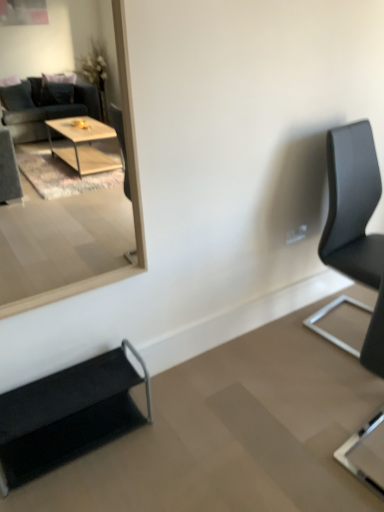
The height and width of the screenshot is (512, 384). What do you see at coordinates (75, 221) in the screenshot?
I see `wooden frame mirror at upper left` at bounding box center [75, 221].

Find the location of a particular element. wooden frame mirror at upper left is located at coordinates (75, 221).

Where is `black leather chair at right, which is counted as the second chair, starting from the right`? black leather chair at right, which is counted as the second chair, starting from the right is located at coordinates (375, 338).

What's the angular difference between wooden frame mirror at upper left and black leather chair at right, the 2th chair positioned from the left,'s facing directions?

The angle between the facing direction of wooden frame mirror at upper left and the facing direction of black leather chair at right, the 2th chair positioned from the left, is 96.2 degrees.

Could you tell me if wooden frame mirror at upper left is turned towards black leather chair at right, the 2th chair positioned from the left?

No.

From the image's perspective, would you say wooden frame mirror at upper left is positioned over black leather chair at right, the 2th chair positioned from the left?

Yes, from the image's perspective, wooden frame mirror at upper left is over black leather chair at right, the 2th chair positioned from the left.

Can you confirm if wooden frame mirror at upper left is bigger than black leather chair at right, the 2th chair positioned from the left?

No, wooden frame mirror at upper left is not bigger than black leather chair at right, the 2th chair positioned from the left.

From the picture: Are black leather chair at right, the 2th chair positioned from the left, and black fabric chair at lower left, the 3th chair positioned from the right, beside each other?

black leather chair at right, the 2th chair positioned from the left, and black fabric chair at lower left, the 3th chair positioned from the right, are clearly separated.

Can you tell me how much black leather chair at right, the 2th chair positioned from the left, and black fabric chair at lower left, the 3th chair positioned from the right, differ in facing direction?

The facing directions of black leather chair at right, the 2th chair positioned from the left, and black fabric chair at lower left, the 3th chair positioned from the right, are 96.2 degrees apart.

From a real-world perspective, who is located higher, black leather chair at right, the 2th chair positioned from the left, or black fabric chair at lower left, the 3th chair positioned from the right?

black leather chair at right, the 2th chair positioned from the left, is physically above.

Which object is closer to the camera taking this photo, black leather chair at right, the 2th chair positioned from the left, or black fabric chair at lower left, marked as the 1th chair in a left-to-right arrangement?

black leather chair at right, the 2th chair positioned from the left, is more forward.

Relative to wooden frame mirror at upper left, is black leather chair at right, the first chair from the right, in front or behind?

Clearly, black leather chair at right, the first chair from the right, is behind wooden frame mirror at upper left.

Starting from the wooden frame mirror at upper left, which chair is the 2nd one behind? Please provide its 2D coordinates.

[(352, 204)]

Between black leather chair at right, the first chair from the right, and wooden frame mirror at upper left, which one has smaller size?

wooden frame mirror at upper left is smaller.

Measure the distance between black leather chair at right, the first chair from the right, and wooden frame mirror at upper left.

black leather chair at right, the first chair from the right, is 14.60 feet away from wooden frame mirror at upper left.

Which is in front, black fabric chair at lower left, the 3th chair positioned from the right, or black leather chair at right, positioned as the third chair in left-to-right order?

Positioned in front is black fabric chair at lower left, the 3th chair positioned from the right.

Which is more to the left, black fabric chair at lower left, marked as the 1th chair in a left-to-right arrangement, or black leather chair at right, the first chair from the right?

black fabric chair at lower left, marked as the 1th chair in a left-to-right arrangement.

You are a GUI agent. You are given a task and a screenshot of the screen. Output one action in this format:
    pyautogui.click(x=<x>, y=<y>)
    Task: Click on the chair that is the 2nd one when counting rightward from the black fabric chair at lower left, marked as the 1th chair in a left-to-right arrangement
    
    Given the screenshot: What is the action you would take?
    pyautogui.click(x=352, y=204)

From a real-world perspective, is black fabric chair at lower left, marked as the 1th chair in a left-to-right arrangement, above or below black leather chair at right, the first chair from the right?

black fabric chair at lower left, marked as the 1th chair in a left-to-right arrangement, is situated lower than black leather chair at right, the first chair from the right, in the real world.

Is the surface of black fabric chair at lower left, the 3th chair positioned from the right, in direct contact with black leather chair at right, the 2th chair positioned from the left?

No, black fabric chair at lower left, the 3th chair positioned from the right, is not making contact with black leather chair at right, the 2th chair positioned from the left.

Looking at this image, is black fabric chair at lower left, marked as the 1th chair in a left-to-right arrangement, completely or partially outside of black leather chair at right, the 2th chair positioned from the left?

Yes, black fabric chair at lower left, marked as the 1th chair in a left-to-right arrangement, is not within black leather chair at right, the 2th chair positioned from the left.

From a real-world perspective, who is located higher, black fabric chair at lower left, marked as the 1th chair in a left-to-right arrangement, or black leather chair at right, which is counted as the second chair, starting from the right?

black leather chair at right, which is counted as the second chair, starting from the right.

How distant is black fabric chair at lower left, the 3th chair positioned from the right, from black leather chair at right, the 2th chair positioned from the left?

The distance of black fabric chair at lower left, the 3th chair positioned from the right, from black leather chair at right, the 2th chair positioned from the left, is 3.30 feet.

Consider the image. Is black leather chair at right, positioned as the third chair in left-to-right order, taller or shorter than black fabric chair at lower left, the 3th chair positioned from the right?

Clearly, black leather chair at right, positioned as the third chair in left-to-right order, is taller compared to black fabric chair at lower left, the 3th chair positioned from the right.

Which object is positioned more to the left, black leather chair at right, the first chair from the right, or black fabric chair at lower left, the 3th chair positioned from the right?

From the viewer's perspective, black fabric chair at lower left, the 3th chair positioned from the right, appears more on the left side.

Is black leather chair at right, positioned as the third chair in left-to-right order, in front of black fabric chair at lower left, the 3th chair positioned from the right?

No, black leather chair at right, positioned as the third chair in left-to-right order, is further to the viewer.

Considering the relative sizes of wooden frame mirror at upper left and black leather chair at right, the first chair from the right, in the image provided, is wooden frame mirror at upper left wider than black leather chair at right, the first chair from the right,?

Incorrect, the width of wooden frame mirror at upper left does not surpass that of black leather chair at right, the first chair from the right.

Find the location of `mirror that appears above the black leather chair at right, positioned as the third chair in left-to-right order (from a real-world perspective)`. mirror that appears above the black leather chair at right, positioned as the third chair in left-to-right order (from a real-world perspective) is located at coordinates (75, 221).

Are wooden frame mirror at upper left and black leather chair at right, positioned as the third chair in left-to-right order, beside each other?

No, wooden frame mirror at upper left is not beside black leather chair at right, positioned as the third chair in left-to-right order.

Is wooden frame mirror at upper left located outside black leather chair at right, the first chair from the right?

Absolutely, wooden frame mirror at upper left is external to black leather chair at right, the first chair from the right.

Which chair is the 1st one when counting from the right side of the wooden frame mirror at upper left? Please provide its 2D coordinates.

[(375, 338)]

I want to click on chair that is the 1st one when counting backward from the black leather chair at right, which is counted as the second chair, starting from the right, so click(68, 414).

Looking at the image, which one is located further to black leather chair at right, which is counted as the second chair, starting from the right, black leather chair at right, the first chair from the right, or black fabric chair at lower left, the 3th chair positioned from the right?

Among the two, black fabric chair at lower left, the 3th chair positioned from the right, is located further to black leather chair at right, which is counted as the second chair, starting from the right.

Looking at the image, which one is located closer to wooden frame mirror at upper left, black fabric chair at lower left, marked as the 1th chair in a left-to-right arrangement, or black leather chair at right, positioned as the third chair in left-to-right order?

Based on the image, black fabric chair at lower left, marked as the 1th chair in a left-to-right arrangement, appears to be nearer to wooden frame mirror at upper left.

When comparing their distances from black leather chair at right, positioned as the third chair in left-to-right order, does black fabric chair at lower left, marked as the 1th chair in a left-to-right arrangement, or wooden frame mirror at upper left seem further?

wooden frame mirror at upper left.

Based on their spatial positions, is black fabric chair at lower left, the 3th chair positioned from the right, or black leather chair at right, the 2th chair positioned from the left, further from wooden frame mirror at upper left?

black leather chair at right, the 2th chair positioned from the left.

When comparing their distances from black fabric chair at lower left, marked as the 1th chair in a left-to-right arrangement, does black leather chair at right, positioned as the third chair in left-to-right order, or black leather chair at right, the 2th chair positioned from the left, seem closer?

black leather chair at right, the 2th chair positioned from the left.

Which object lies further to the anchor point black leather chair at right, which is counted as the second chair, starting from the right, wooden frame mirror at upper left or black fabric chair at lower left, the 3th chair positioned from the right?

Based on the image, wooden frame mirror at upper left appears to be further to black leather chair at right, which is counted as the second chair, starting from the right.

Based on their spatial positions, is black leather chair at right, the first chair from the right, or wooden frame mirror at upper left closer to black fabric chair at lower left, the 3th chair positioned from the right?

Based on the image, black leather chair at right, the first chair from the right, appears to be nearer to black fabric chair at lower left, the 3th chair positioned from the right.

Considering their positions, is black leather chair at right, the 2th chair positioned from the left, positioned closer to wooden frame mirror at upper left than black fabric chair at lower left, marked as the 1th chair in a left-to-right arrangement?

Based on the image, black fabric chair at lower left, marked as the 1th chair in a left-to-right arrangement, appears to be nearer to wooden frame mirror at upper left.

Find the location of a particular element. The height and width of the screenshot is (512, 384). chair located between wooden frame mirror at upper left and black leather chair at right, the first chair from the right, in the left-right direction is located at coordinates (375, 338).

The width and height of the screenshot is (384, 512). Identify the location of mirror situated between black fabric chair at lower left, the 3th chair positioned from the right, and black leather chair at right, the first chair from the right, from left to right. (75, 221).

Image resolution: width=384 pixels, height=512 pixels. Find the location of `mirror situated between black fabric chair at lower left, the 3th chair positioned from the right, and black leather chair at right, the 2th chair positioned from the left, from left to right`. mirror situated between black fabric chair at lower left, the 3th chair positioned from the right, and black leather chair at right, the 2th chair positioned from the left, from left to right is located at coordinates (75, 221).

Locate an element on the screen. The width and height of the screenshot is (384, 512). chair situated between black fabric chair at lower left, marked as the 1th chair in a left-to-right arrangement, and black leather chair at right, the first chair from the right, from left to right is located at coordinates (375, 338).